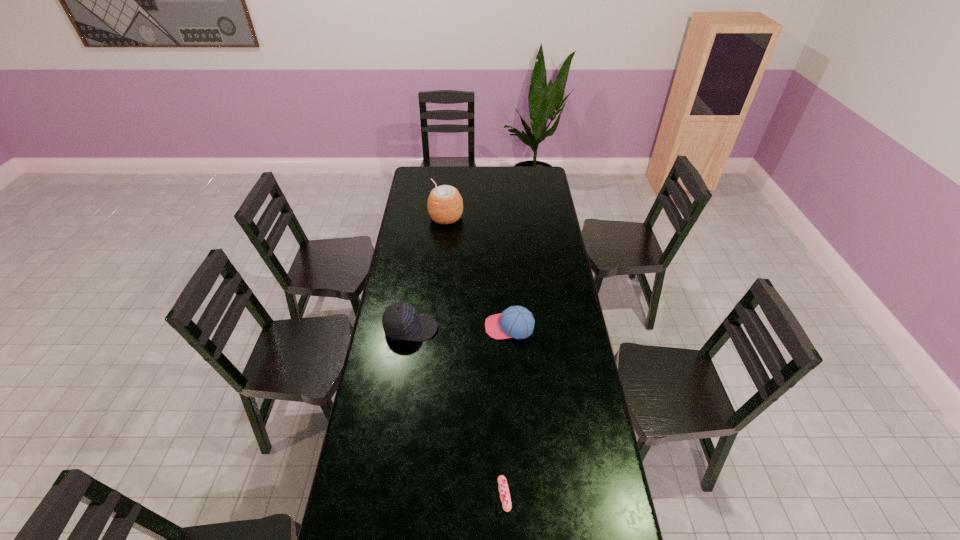
Locate an element on the screen. vacant area that lies between the tallest object and the left baseball cap is located at coordinates (428, 273).

Where is `free spot between the second shortest object and the taller baseball cap`? free spot between the second shortest object and the taller baseball cap is located at coordinates (460, 328).

The width and height of the screenshot is (960, 540). In order to click on free spot between the left baseball cap and the farthest object in this screenshot , I will do `click(428, 273)`.

At what (x,y) coordinates should I click in order to perform the action: click on free spot between the left baseball cap and the tallest object. Please return your answer as a coordinate pair (x, y). Image resolution: width=960 pixels, height=540 pixels. Looking at the image, I should click on (428, 273).

Where is `free space between the taller baseball cap and the right baseball cap`? free space between the taller baseball cap and the right baseball cap is located at coordinates (460, 328).

You are a GUI agent. You are given a task and a screenshot of the screen. Output one action in this format:
    pyautogui.click(x=<x>, y=<y>)
    Task: Click on the free spot between the right baseball cap and the eclair
    
    Given the screenshot: What is the action you would take?
    pyautogui.click(x=507, y=410)

At what (x,y) coordinates should I click in order to perform the action: click on vacant point located between the shortest object and the coconut. Please return your answer as a coordinate pair (x, y). Image resolution: width=960 pixels, height=540 pixels. Looking at the image, I should click on (475, 356).

Locate an element on the screen. This screenshot has height=540, width=960. vacant area between the third shortest object and the farthest object is located at coordinates (428, 273).

In order to click on free space that is in between the tallest object and the taller baseball cap in this screenshot , I will do `click(428, 273)`.

Where is `free space between the farthest object and the left baseball cap`? The width and height of the screenshot is (960, 540). free space between the farthest object and the left baseball cap is located at coordinates (428, 273).